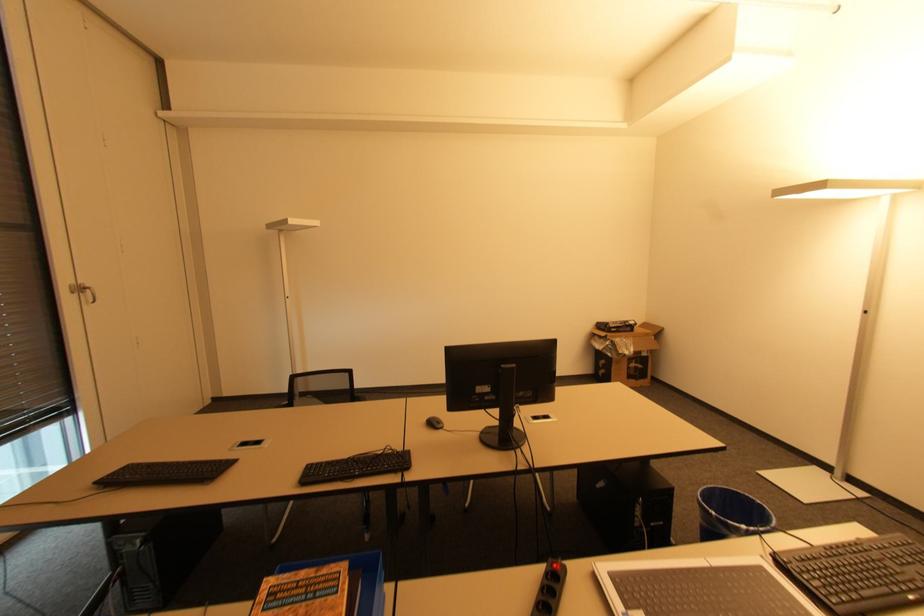
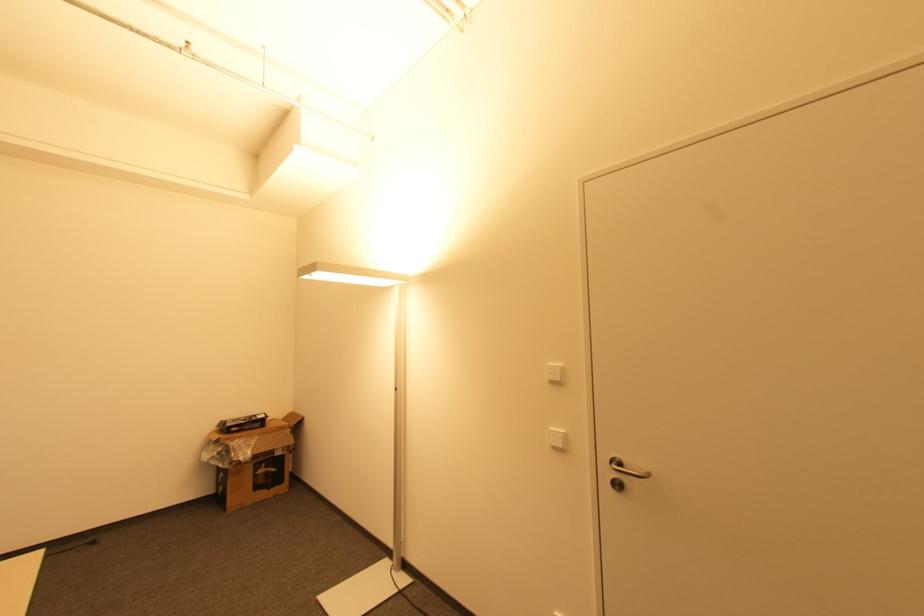
Question: I am providing you with two images of the same scene from different viewpoints. Please identify which objects are invisible in image2.

Choices:
 (A) cardboard box
 (B) silver door handle
 (C) white light switch
 (D) none of these

Answer: (D)